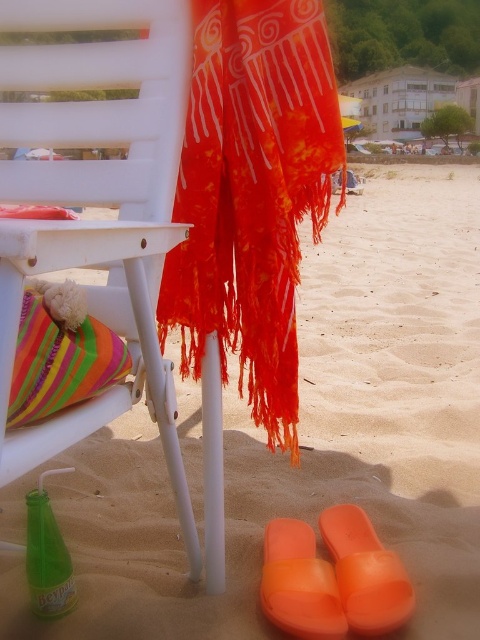
Question: Is sandy yellow sand at lower center positioned behind striped fabric pillow at lower left?

Choices:
 (A) no
 (B) yes

Answer: (A)

Question: Can you confirm if orange rubber sandal at lower right is positioned above green glass bottle at lower left?

Choices:
 (A) yes
 (B) no

Answer: (B)

Question: Based on their relative distances, which object is nearer to the orange rubber sandal at lower center?

Choices:
 (A) white plastic chair at upper left
 (B) orange rubber sandal at lower right
 (C) green glass bottle at lower left

Answer: (B)

Question: Which object appears farthest from the camera in this image?

Choices:
 (A) sandy yellow sand at lower center
 (B) striped fabric pillow at lower left
 (C) green glass bottle at lower left

Answer: (C)

Question: Estimate the real-world distances between objects in this image. Which object is closer to the green glass bottle at lower left?

Choices:
 (A) white plastic chair at upper left
 (B) orange rubber sandal at lower center
 (C) sandy yellow sand at lower center

Answer: (A)

Question: Is white plastic chair at upper left smaller than striped fabric pillow at lower left?

Choices:
 (A) no
 (B) yes

Answer: (A)